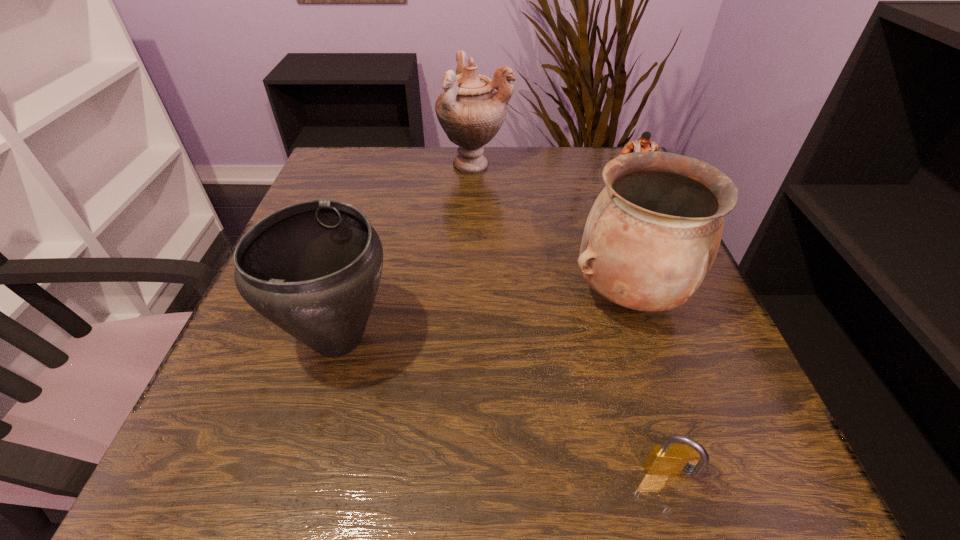
At what (x,y) coordinates should I click in order to perform the action: click on free space that is in between the rightmost urn and the farthest urn. Please return your answer as a coordinate pair (x, y). Looking at the image, I should click on (552, 230).

Locate an element on the screen. vacant area between the fourth nearest object and the leftmost object is located at coordinates (483, 270).

Locate an element on the screen. The width and height of the screenshot is (960, 540). blank region between the rightmost urn and the fourth object from right to left is located at coordinates (552, 230).

This screenshot has height=540, width=960. Find the location of `free space that is in between the farthest object and the rightmost urn`. free space that is in between the farthest object and the rightmost urn is located at coordinates (552, 230).

At what (x,y) coordinates should I click in order to perform the action: click on free area in between the farthest object and the leftmost object. Please return your answer as a coordinate pair (x, y). Looking at the image, I should click on (407, 251).

Locate an element on the screen. This screenshot has width=960, height=540. free space that is in between the leftmost urn and the puncher is located at coordinates (483, 270).

Select which object is the second closest to the fourth tallest object. Please provide its 2D coordinates. Your answer should be formatted as a tuple, i.e. [(x, y)], where the tuple contains the x and y coordinates of a point satisfying the conditions above.

[(470, 111)]

Identify which object is the closest to the nearest object. Please provide its 2D coordinates. Your answer should be formatted as a tuple, i.e. [(x, y)], where the tuple contains the x and y coordinates of a point satisfying the conditions above.

[(651, 237)]

Where is `urn that is the second closest to the leftmost object`? This screenshot has width=960, height=540. urn that is the second closest to the leftmost object is located at coordinates (470, 111).

This screenshot has width=960, height=540. I want to click on urn that is the second closest to the farthest object, so 313,268.